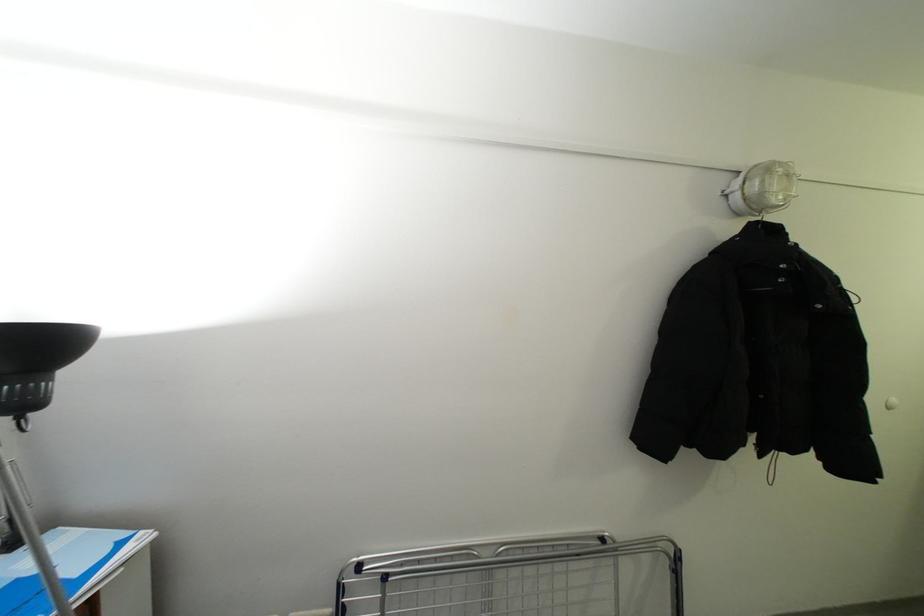
The location [517,578] corresponds to which object?

It refers to a metal drying rack.